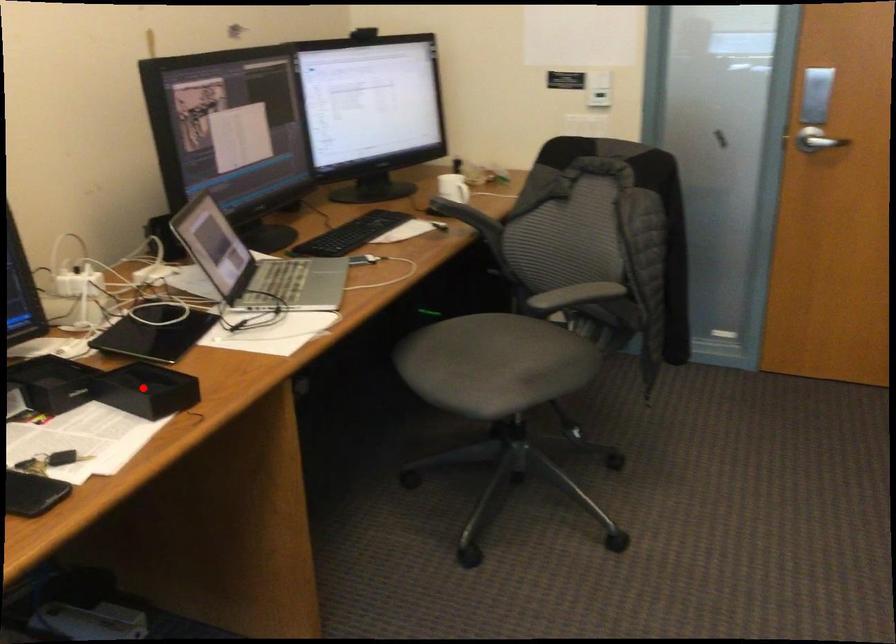
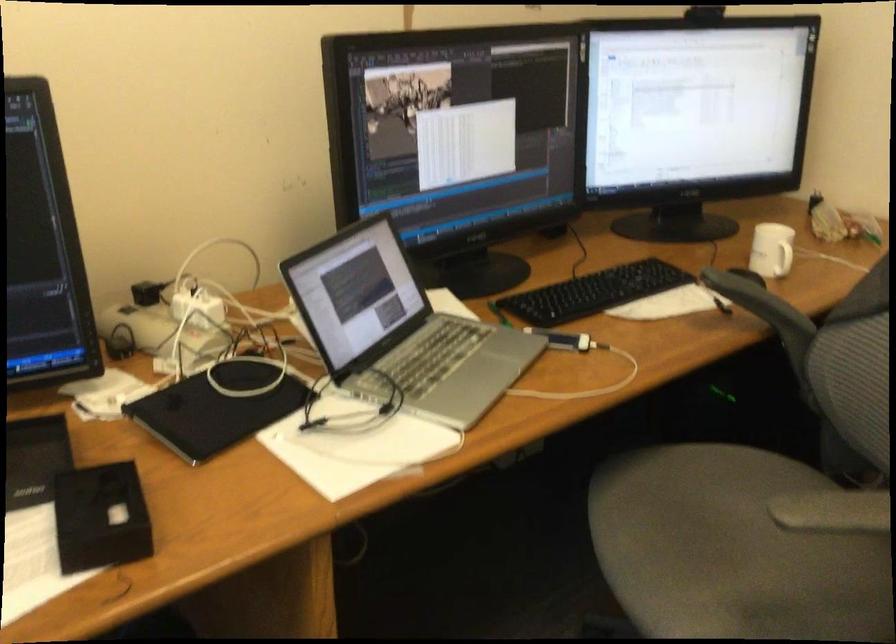
Question: I am providing you with two images of the same scene from different viewpoints. Given a red point in image1, look at the same physical point in image2. Is it:

Choices:
 (A) Closer to the viewpoint
 (B) Farther from the viewpoint

Answer: (A)